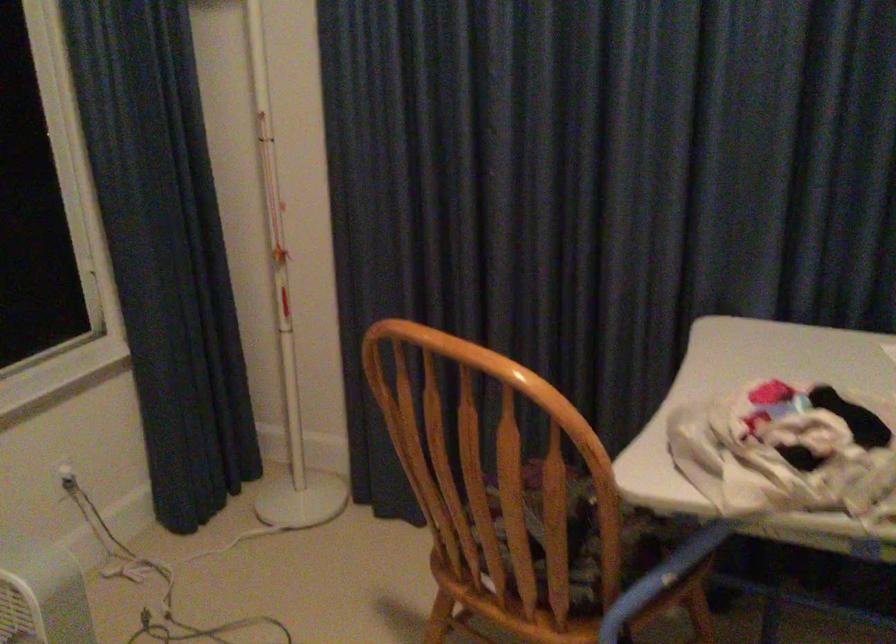
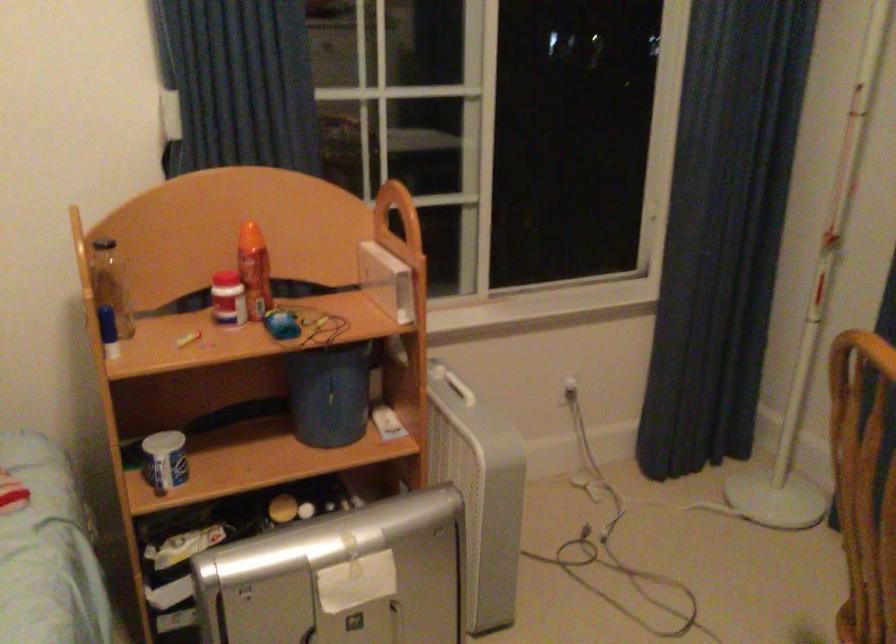
The point at (440, 444) is marked in the first image. Where is the corresponding point in the second image?

(864, 484)